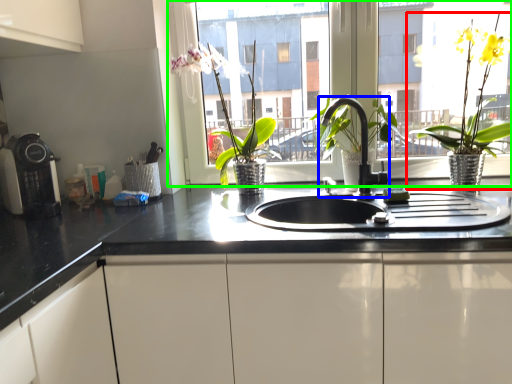
Question: Which object is positioned farthest from houseplant (highlighted by a red box)? Select from tap (highlighted by a blue box) and window (highlighted by a green box).

Choices:
 (A) tap
 (B) window

Answer: (B)